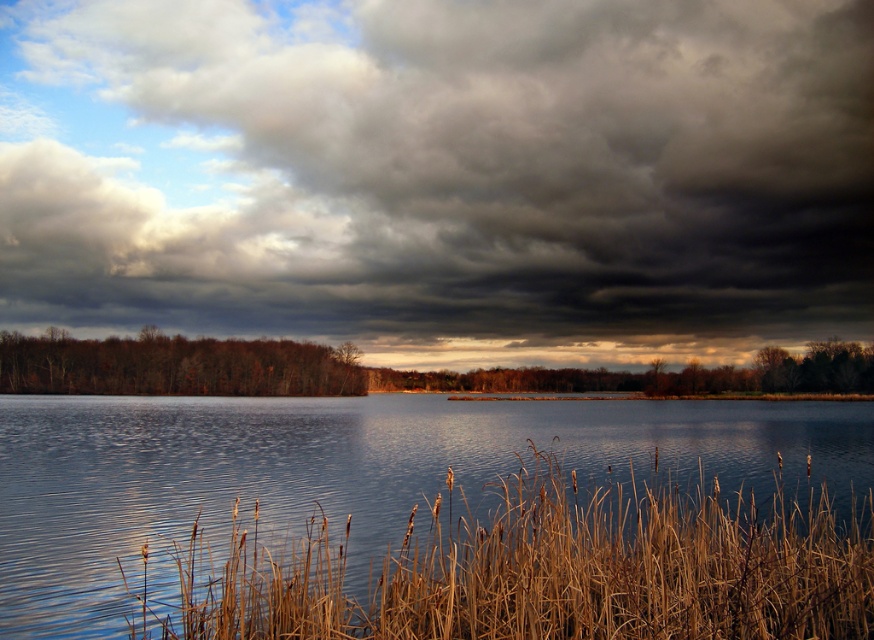
You are standing at the lakeside and notice the dark gray cloud at upper center and the dry grass at lower center. Which object is positioned to the left of the other?

The dark gray cloud at upper center is to the left of dry grass at lower center.

From the picture: You are standing at the lakeside and notice the dark gray cloud at upper center and the dry grass at lower center. Which object is located higher in the scene?

The dark gray cloud at upper center is positioned higher than the dry grass at lower center because it is located over the dry grass at lower center.